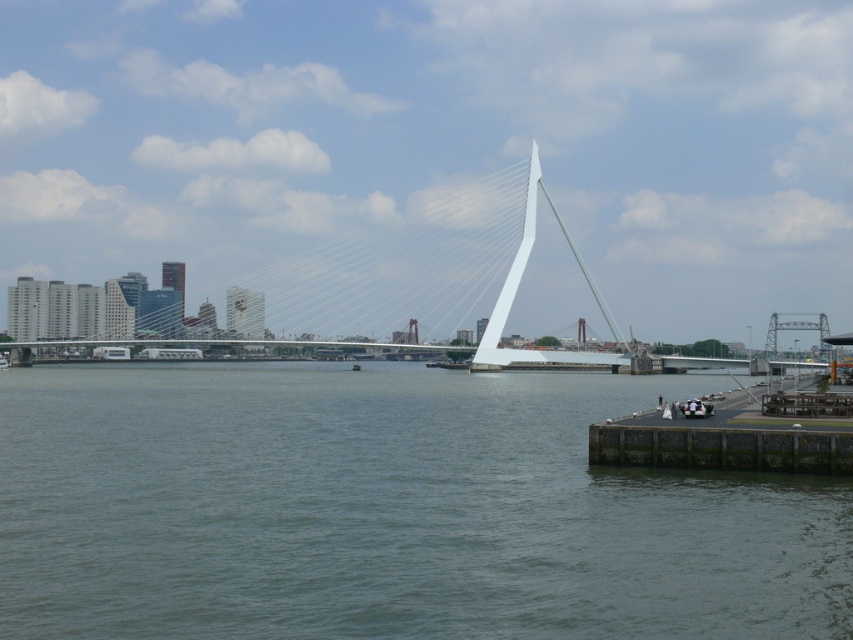
Is greenish-blue water at center smaller than metallic gray boat at lower left?

No, greenish-blue water at center is not smaller than metallic gray boat at lower left.

Is greenish-blue water at center bigger than metallic gray boat at lower left?

Indeed, greenish-blue water at center has a larger size compared to metallic gray boat at lower left.

Between point (115, 595) and point (9, 364), which one is positioned behind?

Point (9, 364)

Locate an element on the screen. The image size is (853, 640). greenish-blue water at center is located at coordinates (387, 509).

Can you confirm if dark gray concrete dock at lower right is wider than metallic gray boat at lower left?

Correct, the width of dark gray concrete dock at lower right exceeds that of metallic gray boat at lower left.

Who is lower down, dark gray concrete dock at lower right or metallic gray boat at lower left?

metallic gray boat at lower left is below.

Does point (753, 424) come in front of point (7, 364)?

Yes, point (753, 424) is closer to viewer.

You are a GUI agent. You are given a task and a screenshot of the screen. Output one action in this format:
    pyautogui.click(x=<x>, y=<y>)
    Task: Click on the dark gray concrete dock at lower right
    The height and width of the screenshot is (640, 853).
    Given the screenshot: What is the action you would take?
    pyautogui.click(x=724, y=440)

Based on the photo, is greenish-blue water at center wider than dark gray concrete dock at lower right?

Yes.

In the scene shown: Between greenish-blue water at center and dark gray concrete dock at lower right, which one has more height?

With more height is greenish-blue water at center.

Between point (444, 490) and point (590, 426), which one is positioned in front?

Point (444, 490) is in front.

This screenshot has width=853, height=640. Find the location of `greenish-blue water at center`. greenish-blue water at center is located at coordinates (387, 509).